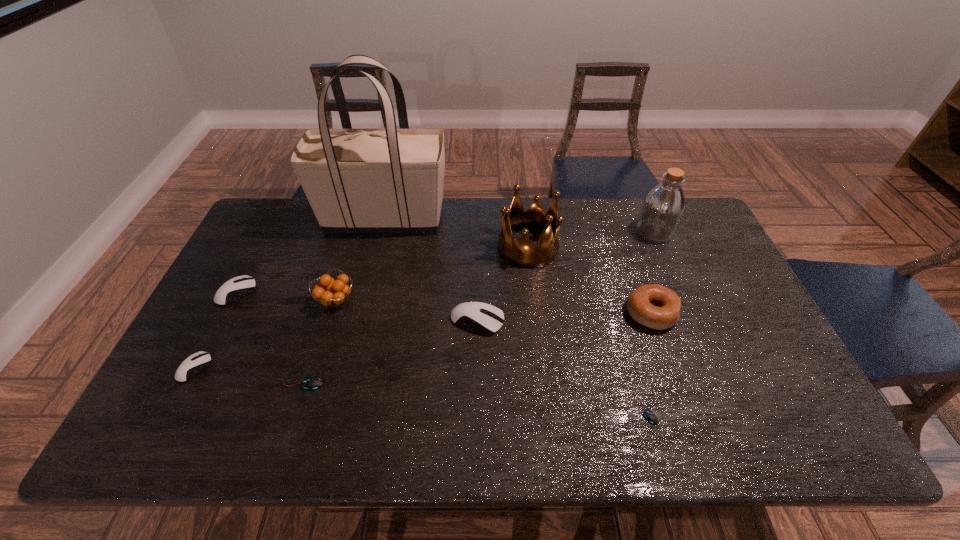
Where is `shopping bag`? This screenshot has height=540, width=960. shopping bag is located at coordinates (390, 180).

This screenshot has height=540, width=960. I want to click on the tallest object, so click(390, 180).

Where is `the second tallest object`? The height and width of the screenshot is (540, 960). the second tallest object is located at coordinates (663, 207).

Where is `crown`? The width and height of the screenshot is (960, 540). crown is located at coordinates (522, 253).

Find the location of a particular element. orange orange fruit is located at coordinates (330, 292).

Where is `orange fruit`? Image resolution: width=960 pixels, height=540 pixels. orange fruit is located at coordinates (330, 292).

At what (x,y) coordinates should I click in order to perform the action: click on the fifth tallest object. Please return your answer as a coordinate pair (x, y). Image resolution: width=960 pixels, height=540 pixels. Looking at the image, I should click on (655, 306).

Locate an element on the screen. the fourth mouse from left to right is located at coordinates (484, 318).

You are a GUI agent. You are given a task and a screenshot of the screen. Output one action in this format:
    pyautogui.click(x=<x>, y=<y>)
    Task: Click on the fourth nearest mouse
    
    Given the screenshot: What is the action you would take?
    pyautogui.click(x=484, y=318)

I want to click on the farthest white mouse, so click(240, 286).